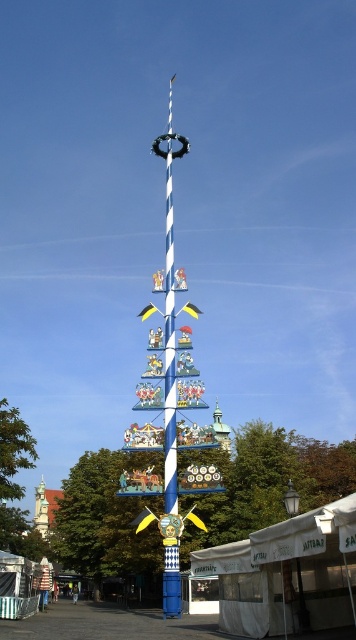
Does white canvas tent at lower right have a lesser width compared to smooth stone tower at lower left?

In fact, white canvas tent at lower right might be wider than smooth stone tower at lower left.

The width and height of the screenshot is (356, 640). In order to click on white canvas tent at lower right in this screenshot , I will do `click(286, 572)`.